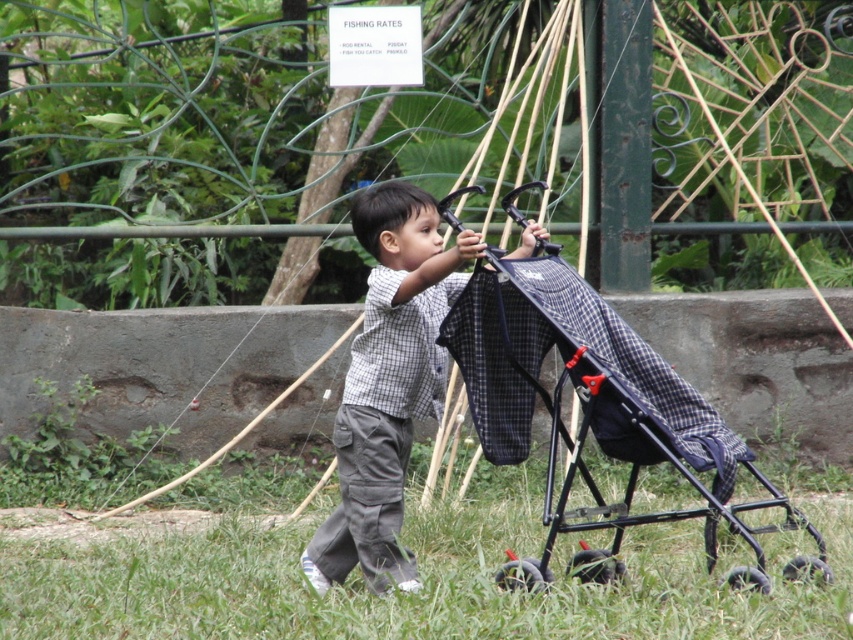
You are a delivery drone trying to land in the park. The landing zone is at point (422, 580). According to the scene, what is the terrain like at the landing zone?

The green grass at lower center is located at point (422, 580), so the terrain at the landing zone is green grass.

You are a parent trying to push the plaid fabric stroller at center through the green grass at lower center. Which direction should you push the stroller to move it onto the grass?

You should push the plaid fabric stroller at center to the left, as the green grass at lower center is located to the left of the stroller.